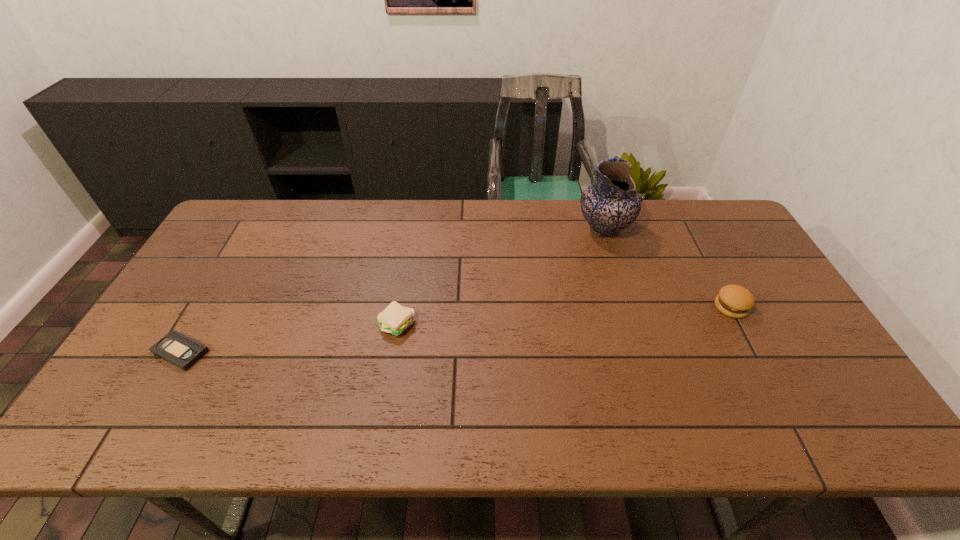
In the image, there is a desktop. Where is `vacant space at the far right corner`? The image size is (960, 540). vacant space at the far right corner is located at coordinates (736, 224).

Find the location of a particular element. free space between the third object from right to left and the rightmost object is located at coordinates (564, 316).

This screenshot has width=960, height=540. What are the coordinates of `free space between the second shortest object and the rightmost object` in the screenshot? It's located at (564, 316).

Where is `free space that is in between the videotape and the rightmost object`? The width and height of the screenshot is (960, 540). free space that is in between the videotape and the rightmost object is located at coordinates (456, 329).

Locate an element on the screen. This screenshot has width=960, height=540. free space that is in between the videotape and the patty is located at coordinates (289, 339).

You are a GUI agent. You are given a task and a screenshot of the screen. Output one action in this format:
    pyautogui.click(x=<x>, y=<y>)
    Task: Click on the vacant space that's between the videotape and the hamburger
    The height and width of the screenshot is (540, 960).
    Given the screenshot: What is the action you would take?
    pyautogui.click(x=456, y=329)

The image size is (960, 540). In order to click on vacant space that is in between the videotape and the third shortest object in this screenshot , I will do `click(456, 329)`.

I want to click on vacant area that lies between the videotape and the rightmost object, so [x=456, y=329].

At what (x,y) coordinates should I click in order to perform the action: click on free space between the patty and the pottery. Please return your answer as a coordinate pair (x, y). This screenshot has width=960, height=540. Looking at the image, I should click on (500, 278).

Locate an element on the screen. free space between the pottery and the shortest object is located at coordinates (393, 291).